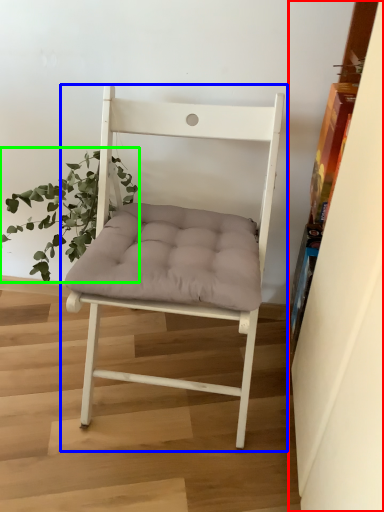
Question: Which is nearer to the shelf (highlighted by a red box)? chair (highlighted by a blue box) or houseplant (highlighted by a green box).

Choices:
 (A) chair
 (B) houseplant

Answer: (A)